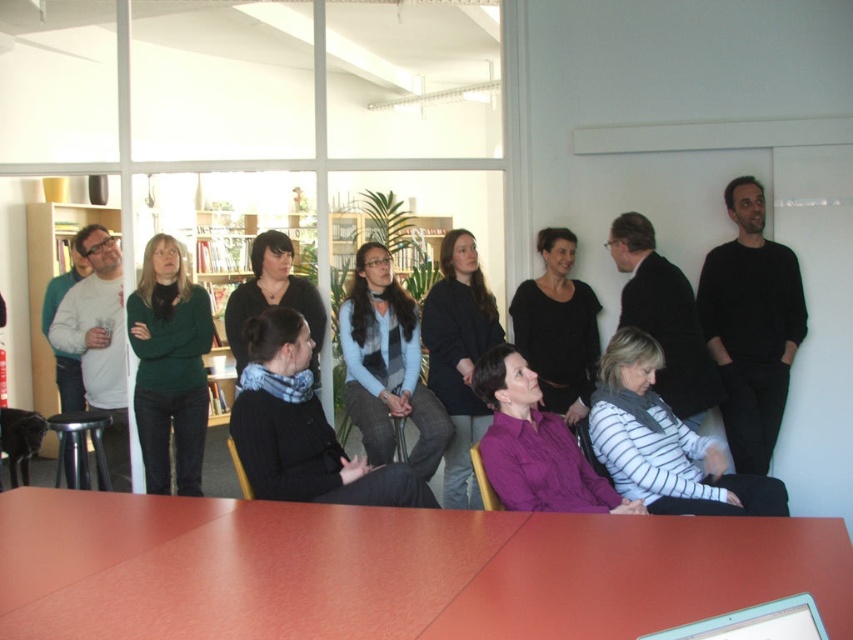
Question: Which point is closer to the camera taking this photo?

Choices:
 (A) (428, 452)
 (B) (239, 368)
 (C) (585, 348)
 (D) (670, 404)

Answer: (D)

Question: Considering the relative positions of black knit sweater at center and black matte shirt at center in the image provided, where is black knit sweater at center located with respect to black matte shirt at center?

Choices:
 (A) right
 (B) left

Answer: (B)

Question: Which object appears closest to the camera in this image?

Choices:
 (A) white striped sweater at lower center
 (B) black matte shirt at center

Answer: (A)

Question: Does black knit sweater at center have a greater width compared to green matte sweater at center?

Choices:
 (A) yes
 (B) no

Answer: (A)

Question: Estimate the real-world distances between objects in this image. Which object is farther from the dark gray sweater at center?

Choices:
 (A) black sweater at center
 (B) green matte sweater at center
 (C) black matte shirt at center
 (D) black matte sweater at right

Answer: (B)

Question: From the image, what is the correct spatial relationship of purple matte shirt at center in relation to black sweater at center?

Choices:
 (A) right
 (B) left

Answer: (A)